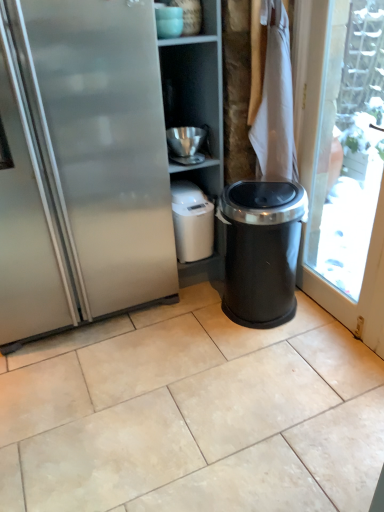
What is the approximate width of white fabric at upper right?

white fabric at upper right is 4.55 centimeters in width.

In order to face matte ceramic bowl at upper center, marked as the 1th appliance in a front-to-back arrangement, should I rotate leftwards or rightwards?

Rotate left and turn 3.005 degrees.

The height and width of the screenshot is (512, 384). What do you see at coordinates (261, 251) in the screenshot? I see `black plastic trash can at right` at bounding box center [261, 251].

The image size is (384, 512). Identify the location of black plastic trash can at right. (261, 251).

The image size is (384, 512). Find the location of `beige ceramic tile at center`. beige ceramic tile at center is located at coordinates (193, 414).

In the scene shown: Is white matte appliance at center, which is counted as the 3th appliance, starting from the front, situated inside matte ceramic bowl at upper center, which is the third appliance in back-to-front order, or outside?

The correct answer is: outside.

The height and width of the screenshot is (512, 384). What are the coordinates of `the 2nd appliance behind the matte ceramic bowl at upper center, which is the third appliance in back-to-front order` in the screenshot? It's located at (192, 222).

How far apart are white matte appliance at center, arranged as the first appliance when viewed from the back, and matte ceramic bowl at upper center, marked as the 1th appliance in a front-to-back arrangement?

white matte appliance at center, arranged as the first appliance when viewed from the back, and matte ceramic bowl at upper center, marked as the 1th appliance in a front-to-back arrangement, are 33.30 inches apart.

From a real-world perspective, which is physically above, white matte appliance at center, which appears as the 3th appliance when viewed from the top, or matte ceramic bowl at upper center, which is the third appliance in back-to-front order?

matte ceramic bowl at upper center, which is the third appliance in back-to-front order.

Which object is thinner, black plastic trash can at right or white matte appliance at center, which appears as the 3th appliance when viewed from the top?

white matte appliance at center, which appears as the 3th appliance when viewed from the top, is thinner.

From the image's perspective, is black plastic trash can at right located above or below white matte appliance at center, which is counted as the 3th appliance, starting from the front?

black plastic trash can at right is situated lower than white matte appliance at center, which is counted as the 3th appliance, starting from the front, in the image.

At what (x,y) coordinates should I click in order to perform the action: click on appliance that is the 1st one when counting upward from the black plastic trash can at right (from the image's perspective). Please return your answer as a coordinate pair (x, y). Looking at the image, I should click on (192, 222).

Can you tell me how much black plastic trash can at right and white matte appliance at center, arranged as the first appliance when viewed from the back, differ in facing direction?

91.9 degrees.

Is white matte appliance at center, which is counted as the 3th appliance, starting from the front, far from metallic silver bowl at upper center, which ranks as the second appliance in bottom-to-top order?

Actually, white matte appliance at center, which is counted as the 3th appliance, starting from the front, and metallic silver bowl at upper center, which ranks as the second appliance in bottom-to-top order, are a little close together.

Is point (195, 218) behind point (185, 135)?

Yes, point (195, 218) is farther from viewer.

Considering the positions of objects white matte appliance at center, which appears as the 1th appliance when ordered from the bottom, and metallic silver bowl at upper center, marked as the 2th appliance in a top-to-bottom arrangement, in the image provided, who is more to the left, white matte appliance at center, which appears as the 1th appliance when ordered from the bottom, or metallic silver bowl at upper center, marked as the 2th appliance in a top-to-bottom arrangement,?

Positioned to the left is metallic silver bowl at upper center, marked as the 2th appliance in a top-to-bottom arrangement.

Does white matte appliance at center, which appears as the 1th appliance when ordered from the bottom, have a lesser height compared to metallic silver bowl at upper center, marked as the 2th appliance in a top-to-bottom arrangement?

In fact, white matte appliance at center, which appears as the 1th appliance when ordered from the bottom, may be taller than metallic silver bowl at upper center, marked as the 2th appliance in a top-to-bottom arrangement.

Between point (236, 233) and point (164, 7), which one is positioned in front?

The point (164, 7) is closer.

Which object is closer to the camera taking this photo, black plastic trash can at right or matte ceramic bowl at upper center, which is the third appliance in back-to-front order?

Positioned in front is black plastic trash can at right.

Can you confirm if black plastic trash can at right is bigger than matte ceramic bowl at upper center, the first appliance from the top?

Correct, black plastic trash can at right is larger in size than matte ceramic bowl at upper center, the first appliance from the top.

Is white matte appliance at center, which appears as the 1th appliance when ordered from the bottom, to the right of white fabric at upper right from the viewer's perspective?

In fact, white matte appliance at center, which appears as the 1th appliance when ordered from the bottom, is to the left of white fabric at upper right.

Considering the relative sizes of white matte appliance at center, arranged as the first appliance when viewed from the back, and white fabric at upper right in the image provided, is white matte appliance at center, arranged as the first appliance when viewed from the back, wider than white fabric at upper right?

Yes.

Considering the positions of points (191, 250) and (275, 8), is point (191, 250) closer to camera compared to point (275, 8)?

No, it is behind (275, 8).

Can you tell me how much white matte appliance at center, which appears as the 1th appliance when ordered from the bottom, and white fabric at upper right differ in facing direction?

3.49 degrees.

From a real-world perspective, is white fabric at upper right located higher than metallic silver bowl at upper center, marked as the 2th appliance in a top-to-bottom arrangement?

Yes, from a real-world perspective, white fabric at upper right is on top of metallic silver bowl at upper center, marked as the 2th appliance in a top-to-bottom arrangement.

Looking at this image, is white fabric at upper right further to the viewer compared to metallic silver bowl at upper center, which ranks as the second appliance in bottom-to-top order?

No, it is in front of metallic silver bowl at upper center, which ranks as the second appliance in bottom-to-top order.

Is white fabric at upper right oriented away from metallic silver bowl at upper center, which appears as the second appliance when viewed from the back?

No, white fabric at upper right is not facing the opposite direction of metallic silver bowl at upper center, which appears as the second appliance when viewed from the back.

Is stainless steel fridge at left not inside white fabric at upper right?

stainless steel fridge at left lies outside white fabric at upper right's area.

Considering the sizes of objects stainless steel fridge at left and white fabric at upper right in the image provided, who is smaller, stainless steel fridge at left or white fabric at upper right?

With smaller size is white fabric at upper right.

Does stainless steel fridge at left have a lesser height compared to white fabric at upper right?

In fact, stainless steel fridge at left may be taller than white fabric at upper right.

From a real-world perspective, is stainless steel fridge at left positioned above or below white fabric at upper right?

Clearly, from a real-world perspective, stainless steel fridge at left is below white fabric at upper right.

I want to click on appliance that is the 2nd object directly below the matte ceramic bowl at upper center, acting as the 3th appliance starting from the bottom (from a real-world perspective), so click(192, 222).

Identify the location of waste container on the right of white matte appliance at center, which appears as the 3th appliance when viewed from the top. (261, 251).

Based on their spatial positions, is black plastic trash can at right or metallic silver bowl at upper center, which ranks as the second appliance in bottom-to-top order, closer to white matte appliance at center, which appears as the 1th appliance when ordered from the bottom?

metallic silver bowl at upper center, which ranks as the second appliance in bottom-to-top order, lies closer to white matte appliance at center, which appears as the 1th appliance when ordered from the bottom, than the other object.

Looking at this image, looking at the image, which one is located further to beige ceramic tile at center, white fabric at upper right or matte ceramic bowl at upper center, marked as the 1th appliance in a front-to-back arrangement?

The object further to beige ceramic tile at center is matte ceramic bowl at upper center, marked as the 1th appliance in a front-to-back arrangement.

Which object lies nearer to the anchor point metallic silver bowl at upper center, which appears as the second appliance when viewed from the back, black plastic trash can at right or stainless steel fridge at left?

The object closer to metallic silver bowl at upper center, which appears as the second appliance when viewed from the back, is black plastic trash can at right.

Based on their spatial positions, is metallic silver bowl at upper center, which appears as the second appliance when viewed from the back, or matte ceramic bowl at upper center, the first appliance from the top, further from beige ceramic tile at center?

matte ceramic bowl at upper center, the first appliance from the top, is further to beige ceramic tile at center.

Considering their positions, is stainless steel fridge at left positioned closer to white fabric at upper right than white matte appliance at center, arranged as the first appliance when viewed from the back?

white matte appliance at center, arranged as the first appliance when viewed from the back, is closer to white fabric at upper right.

Looking at this image, estimate the real-world distances between objects in this image. Which object is further from matte ceramic bowl at upper center, acting as the 3th appliance starting from the bottom, white fabric at upper right or white matte appliance at center, which appears as the 1th appliance when ordered from the bottom?

white matte appliance at center, which appears as the 1th appliance when ordered from the bottom, is positioned further to the anchor matte ceramic bowl at upper center, acting as the 3th appliance starting from the bottom.

Based on their spatial positions, is stainless steel fridge at left or black plastic trash can at right closer to white fabric at upper right?

black plastic trash can at right.

Looking at the image, which one is located closer to matte ceramic bowl at upper center, acting as the 3th appliance starting from the bottom, white fabric at upper right or black plastic trash can at right?

white fabric at upper right lies closer to matte ceramic bowl at upper center, acting as the 3th appliance starting from the bottom, than the other object.

This screenshot has width=384, height=512. In order to click on fridge between beige ceramic tile at center and white matte appliance at center, arranged as the first appliance when viewed from the back, from front to back in this screenshot , I will do `click(84, 165)`.

You are a GUI agent. You are given a task and a screenshot of the screen. Output one action in this format:
    pyautogui.click(x=<x>, y=<y>)
    Task: Click on the laundry between matte ceramic bowl at upper center, acting as the 3th appliance starting from the bottom, and beige ceramic tile at center, in the vertical direction
    This screenshot has width=384, height=512.
    Given the screenshot: What is the action you would take?
    pyautogui.click(x=274, y=98)

The height and width of the screenshot is (512, 384). I want to click on laundry between matte ceramic bowl at upper center, the first appliance from the top, and white matte appliance at center, which appears as the 3th appliance when viewed from the top, in the up-down direction, so 274,98.

This screenshot has width=384, height=512. Identify the location of appliance between white fabric at upper right and white matte appliance at center, arranged as the first appliance when viewed from the back, from top to bottom. (186, 144).